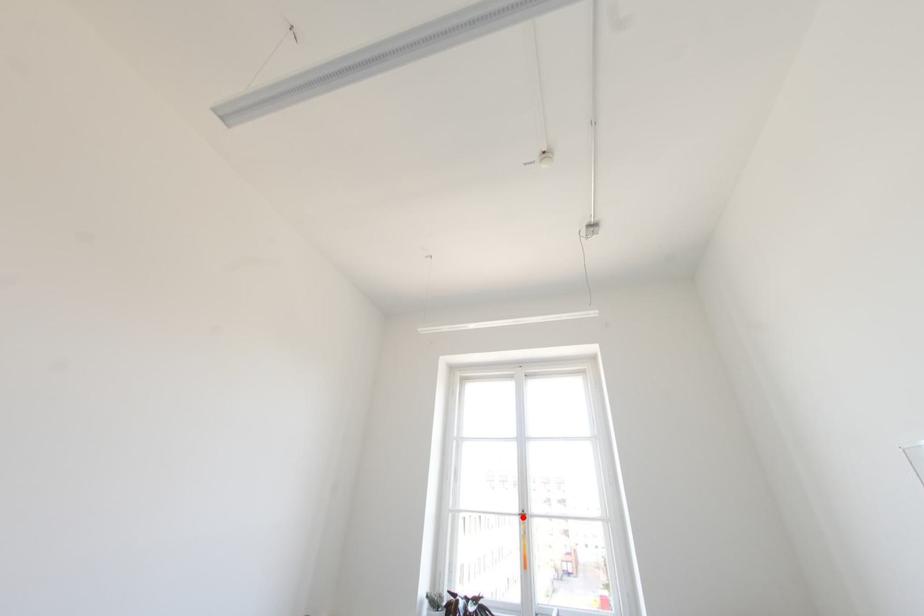
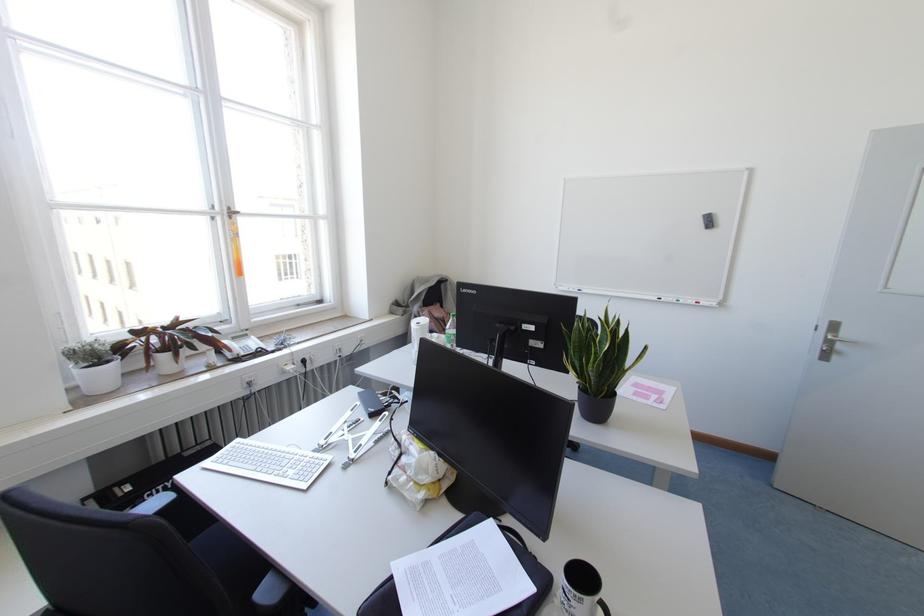
Question: I am providing you with two images of the same scene from different viewpoints. Image1 has a red point marked. In image2, the corresponding 3D location appears at what relative position? Reply with the corresponding letter.

Choices:
 (A) Closer
 (B) Farther

Answer: (A)